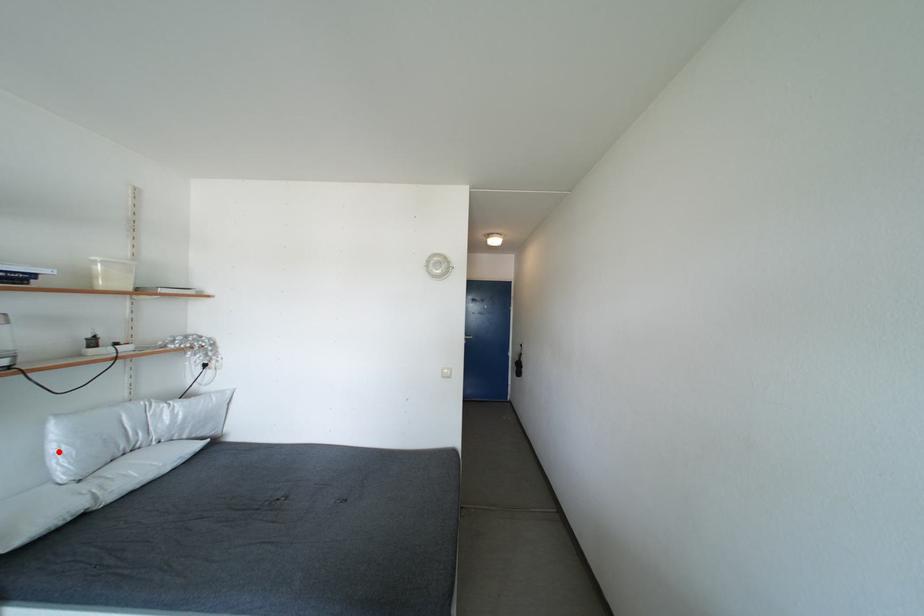
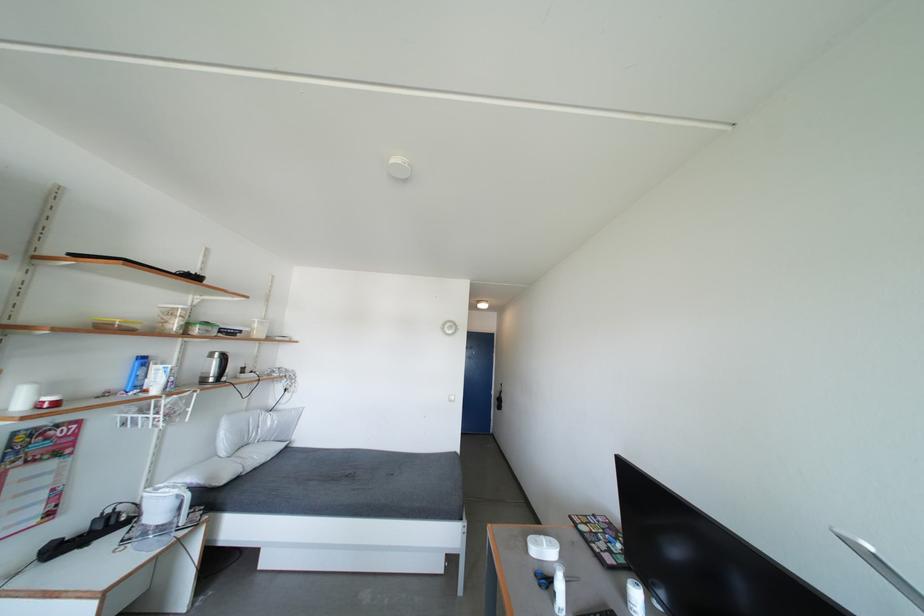
Where in the second image is the point corresponding to the highlighted location from the first image?

(228, 439)